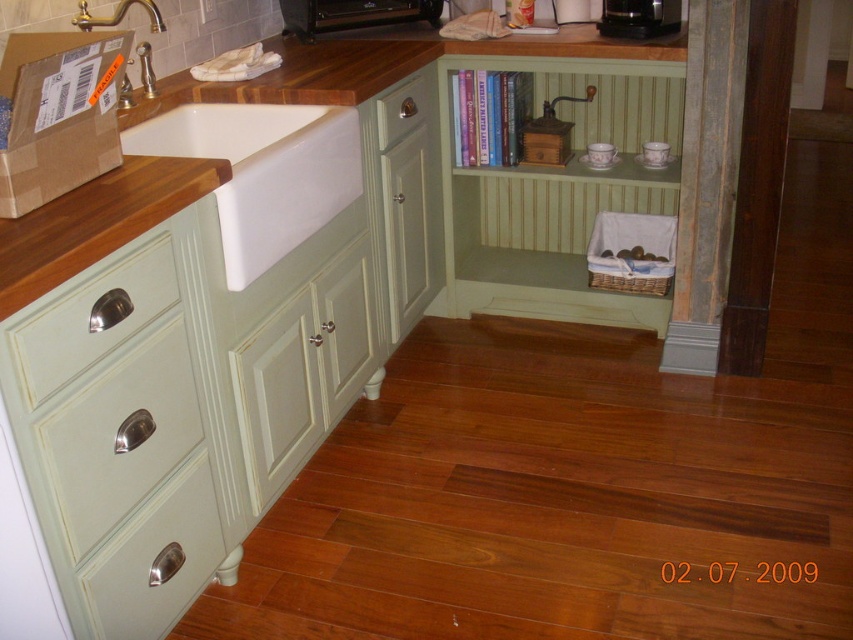
Question: Does white glossy sink at left lie in front of gold polished faucet at upper left?

Choices:
 (A) no
 (B) yes

Answer: (B)

Question: Among these objects, which one is farthest from the camera?

Choices:
 (A) satin nickel drawer at center
 (B) matte cream drawer at lower left
 (C) white glossy drawer at lower left

Answer: (A)

Question: Estimate the real-world distances between objects in this image. Which object is farther from the white glossy drawer at lower left?

Choices:
 (A) satin nickel drawer at center
 (B) white glossy sink at left
 (C) brushed metal faucet at upper left
 (D) black plastic toaster at upper center

Answer: (D)

Question: Considering the relative positions of satin silver drawer at lower left and matte cream drawer at lower left in the image provided, where is satin silver drawer at lower left located with respect to matte cream drawer at lower left?

Choices:
 (A) below
 (B) above

Answer: (B)

Question: Which object is the closest to the white glossy sink at left?

Choices:
 (A) satin silver drawer at lower left
 (B) gold polished faucet at upper left
 (C) brushed metal faucet at upper left
 (D) matte cream drawer at lower left

Answer: (B)

Question: Does brown wood countertop at upper left have a lesser width compared to brushed metal faucet at upper left?

Choices:
 (A) no
 (B) yes

Answer: (A)